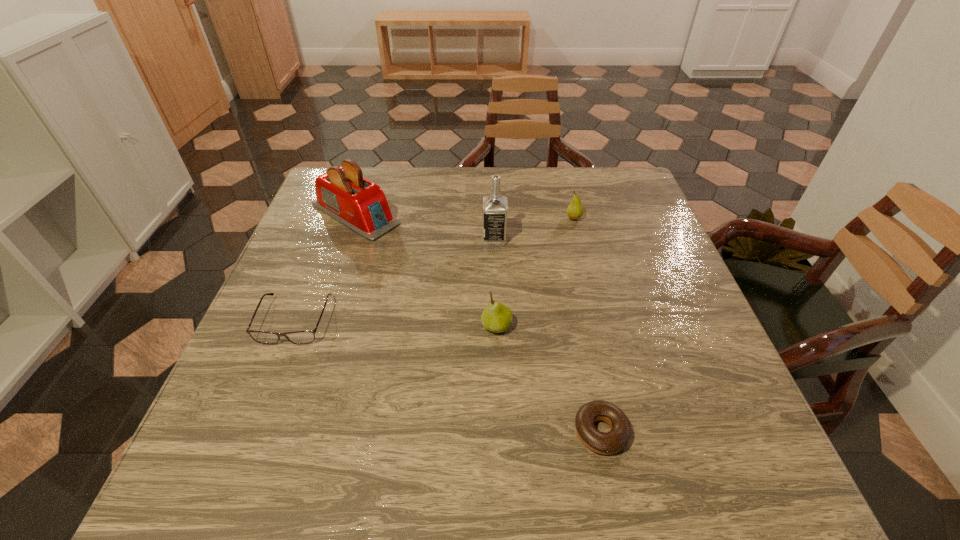
This screenshot has width=960, height=540. Find the location of `free space between the toaster and the spectacles`. free space between the toaster and the spectacles is located at coordinates (325, 267).

The image size is (960, 540). Identify the location of vacant region between the nearer pear and the toaster. (426, 270).

Find the location of a particular element. vacant area that lies between the nearest object and the right pear is located at coordinates (588, 325).

The height and width of the screenshot is (540, 960). Find the location of `vacant space that is in between the right pear and the spectacles`. vacant space that is in between the right pear and the spectacles is located at coordinates (435, 269).

Identify which object is located as the fifth nearest to the doughnut. Please provide its 2D coordinates. Your answer should be formatted as a tuple, i.e. [(x, y)], where the tuple contains the x and y coordinates of a point satisfying the conditions above.

[(342, 193)]

Find the location of a particular element. The height and width of the screenshot is (540, 960). object that is the fourth closest to the doughnut is located at coordinates (575, 210).

Locate an element on the screen. blank space that satisfies the following two spatial constraints: 1. on the front label of the nearest object; 2. on the left side of the tallest object is located at coordinates (501, 431).

Identify the location of vacant point that satisfies the following two spatial constraints: 1. on the front label of the vodka; 2. on the lenses of the spectacles. This screenshot has width=960, height=540. (497, 320).

Locate an element on the screen. free location that satisfies the following two spatial constraints: 1. on the lenses of the left pear; 2. on the right side of the spectacles is located at coordinates (293, 326).

Locate an element on the screen. free space that satisfies the following two spatial constraints: 1. on the lenses of the spectacles; 2. on the left side of the left pear is located at coordinates (293, 326).